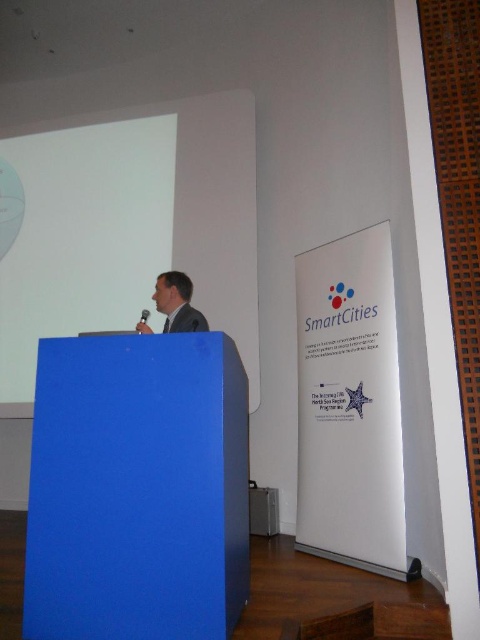
You are an event organizer setting up a camera to capture both the speaker in the blue suit at center and the white matte projection screen at upper center. Based on their positions, which object is wider from the camera perspective?

The white matte projection screen at upper center might be wider than blue suit at center, so the projection screen would appear wider in the camera view.